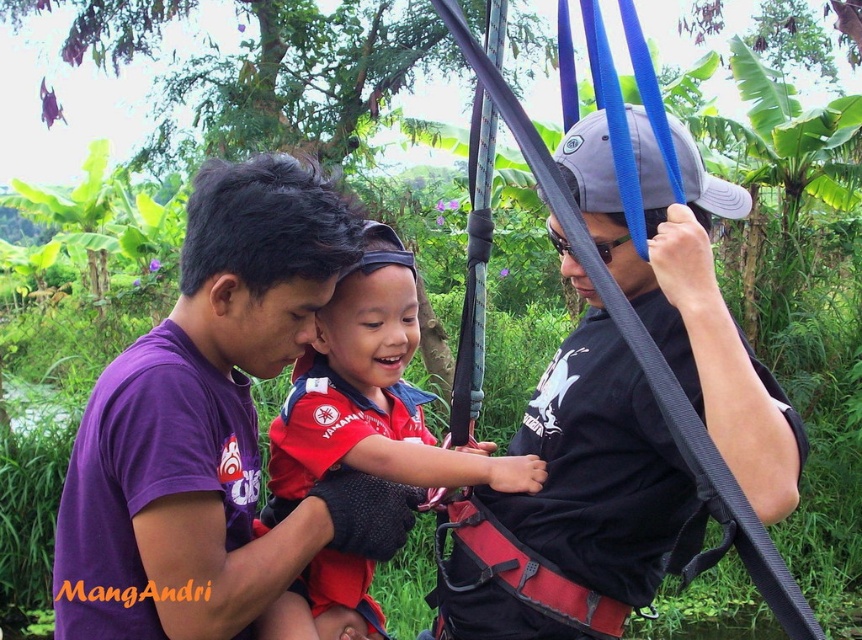
What is located at the coordinates (201, 420)?

The purple cotton shirt at center is located at the coordinates (201, 420).

Based on the photo, you are a safety inspector checking the equipment in the image. The black fabric harness at center and the red matte life vest at center are both present. According to safety regulations, which of these two items must be worn by someone in this environment?

The red matte life vest at center must be worn because it is a safety requirement for water activities, while the black fabric harness at center is typically used for climbing or high elevation work and may not be necessary here.

Based on the scene description, which object is positioned closer to the observer between the black fabric harness at center and the red matte life vest at center?

The black fabric harness at center is closer to the observer than the red matte life vest at center.